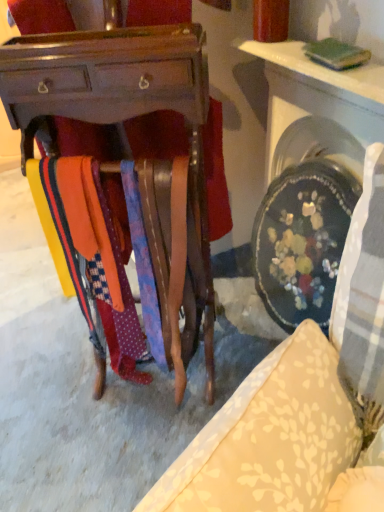
Question: Is wooden desk at center taller or shorter than polka dot fabric tie at center?

Choices:
 (A) tall
 (B) short

Answer: (A)

Question: From a real-world perspective, is wooden desk at center physically located above or below polka dot fabric tie at center?

Choices:
 (A) above
 (B) below

Answer: (A)

Question: Considering the real-world distances, which object is closest to the wooden desk at center?

Choices:
 (A) polka dot fabric tie at center
 (B) wooden tie rack at center
 (C) white glossy table at upper right
 (D) orange fabric at center

Answer: (A)

Question: Which object is positioned closest to the wooden desk at center?

Choices:
 (A) white glossy table at upper right
 (B) wooden tie rack at center
 (C) orange fabric at center
 (D) polka dot fabric tie at center

Answer: (D)